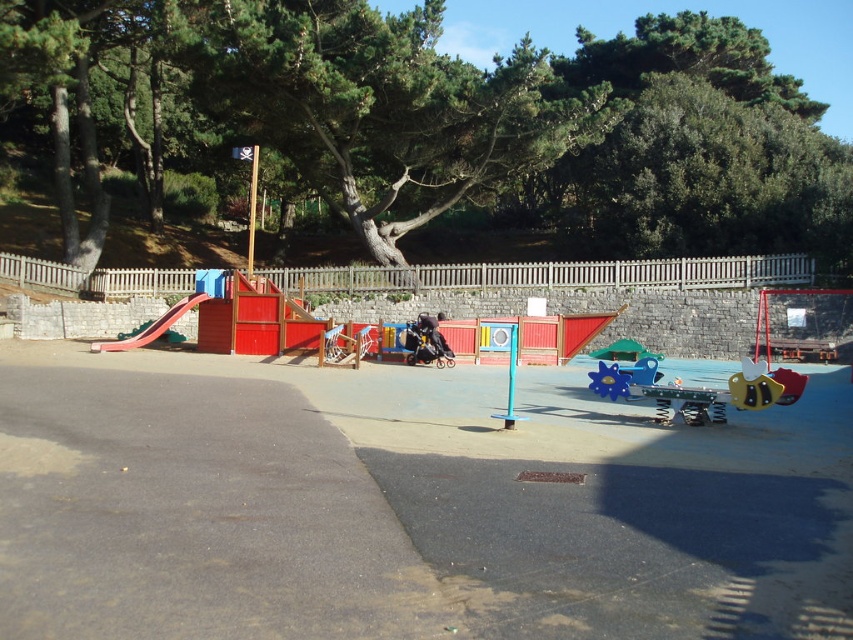
From the picture: Who is higher up, red plastic slide at left or blue plastic spinner at center?

Positioned higher is red plastic slide at left.

The width and height of the screenshot is (853, 640). What are the coordinates of `red plastic slide at left` in the screenshot? It's located at (151, 326).